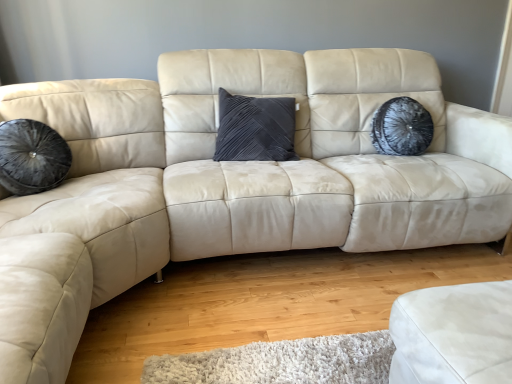
This screenshot has height=384, width=512. In order to click on velvet black pillow at upper right in this screenshot , I will do `click(402, 127)`.

Describe the element at coordinates (402, 127) in the screenshot. The width and height of the screenshot is (512, 384). I see `velvet black pillow at upper right` at that location.

At what (x,y) coordinates should I click in order to perform the action: click on velvet black pillow at upper right. Please return your answer as a coordinate pair (x, y). This screenshot has height=384, width=512. Looking at the image, I should click on (402, 127).